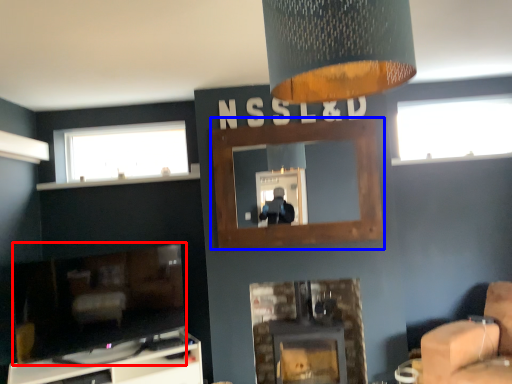
Question: Which object is closer to the camera taking this photo, fireplace (highlighted by a red box) or fireplace (highlighted by a blue box)?

Choices:
 (A) fireplace
 (B) fireplace

Answer: (A)